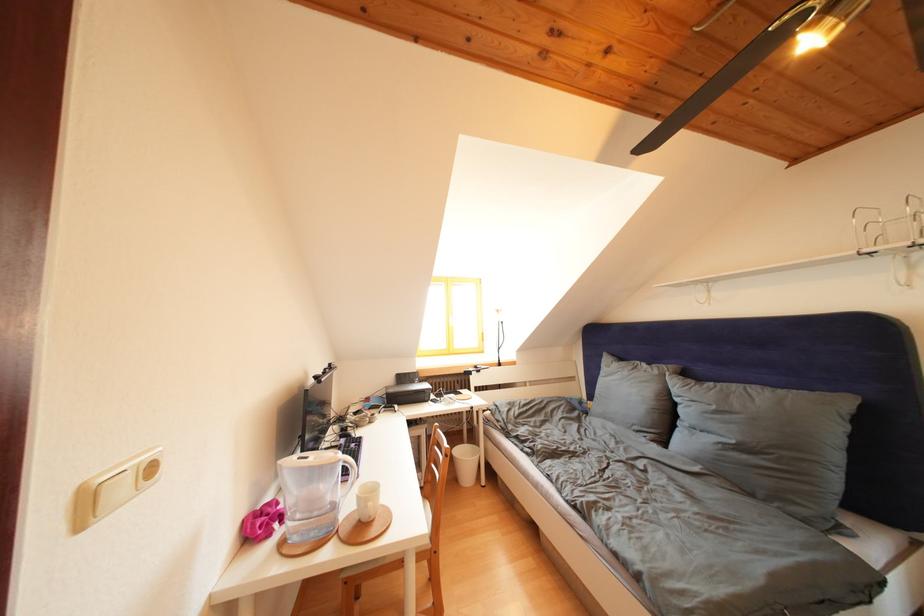
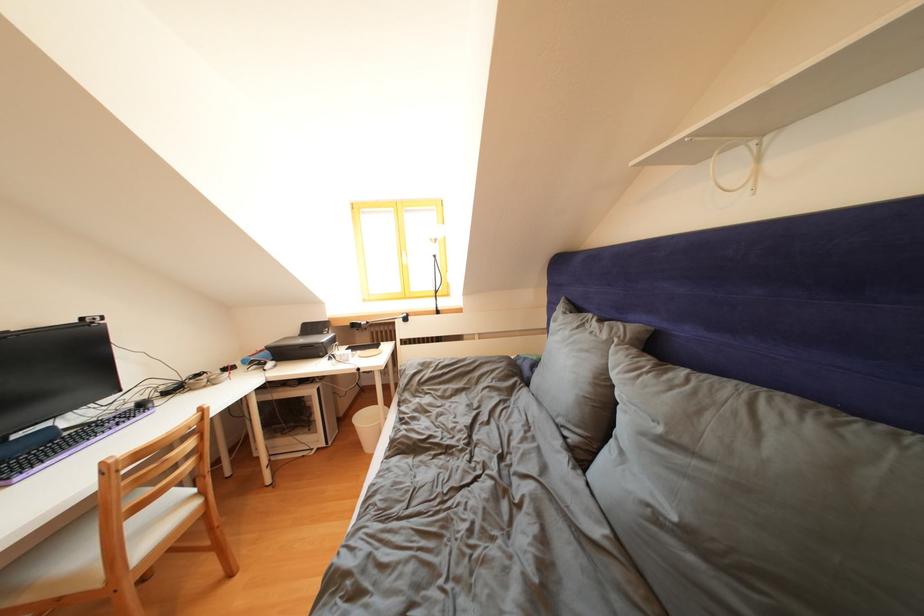
Where in the second image is the point corresponding to point 663,377 from the first image?

(612, 341)